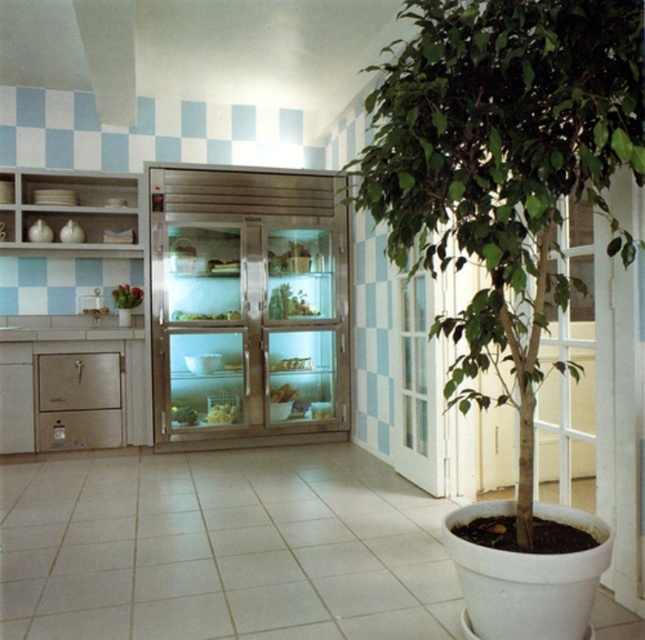
In order to click on green leafy plant at center in this screenshot , I will do `click(502, 170)`.

Does green leafy plant at center have a greater height compared to green leafy vegetables at center?

Correct, green leafy plant at center is much taller as green leafy vegetables at center.

Is point (533, 77) positioned before point (212, 412)?

Yes, it is in front of point (212, 412).

Locate an element on the screen. This screenshot has width=645, height=640. green leafy plant at center is located at coordinates (502, 170).